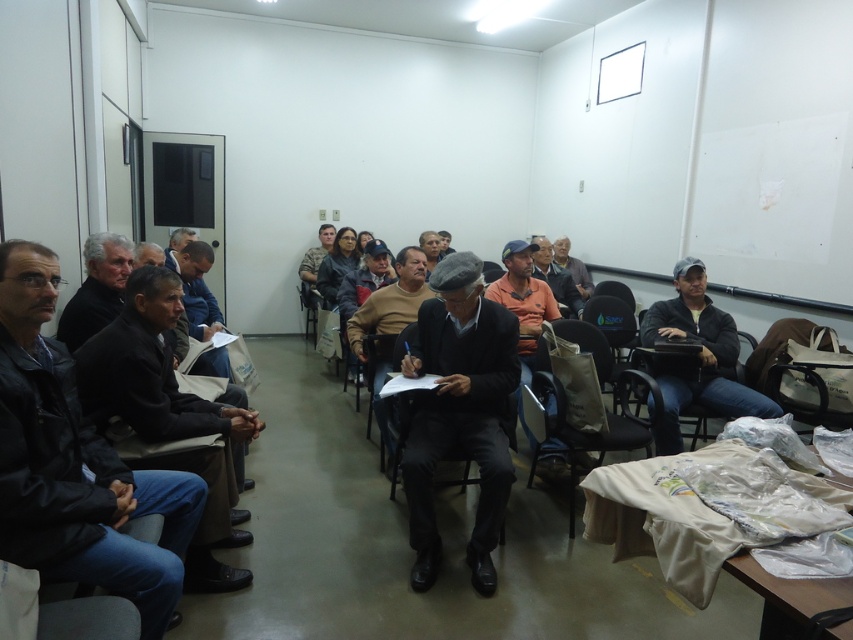
You are organizing a storage closet and need to place the dark gray woolen hat at center and the dark brown leather jacket at left. Given their sizes, which item should you place first in a shelf to maximize space efficiency?

The dark gray woolen hat at center has a smaller size compared to the dark brown leather jacket at left, so you should place the dark gray woolen hat at center first to maximize space efficiency by stacking smaller items first.

You are sitting in the front row of the room and want to hand a document to the person wearing the orange cotton shirt at center. The black fabric chair at center is between you and them. Can you reach the person without moving the chair?

The orange cotton shirt at center is further to the viewer than the black fabric chair at center, meaning the shirt is closer to you. Since the chair is between you and the shirt, you can reach the person without moving the chair because the shirt is in front of the chair.

You are a photographer taking a photo of the orange cotton shirt at center and the black fabric chair at center. Which object should you focus on first if you want to capture both clearly in the same frame?

The orange cotton shirt at center is much taller than the black fabric chair at center, so you should focus on the orange cotton shirt at center first to ensure both are in focus.